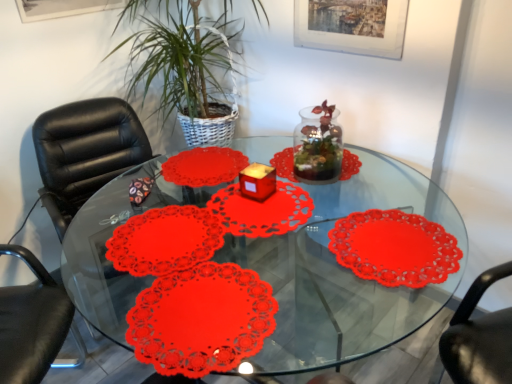
Where is `vacant space situated on the left part of transparent glass jar at center`? This screenshot has width=512, height=384. vacant space situated on the left part of transparent glass jar at center is located at coordinates (269, 185).